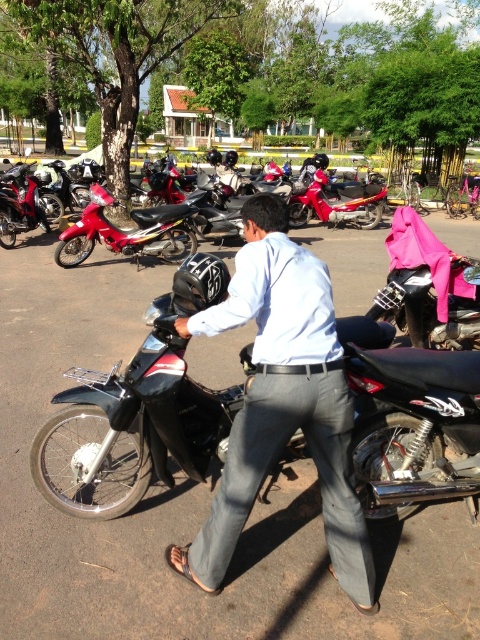
Is shiny black motorcycle at center above light blue shirt at center?

Actually, shiny black motorcycle at center is below light blue shirt at center.

This screenshot has height=640, width=480. What are the coordinates of `shiny black motorcycle at center` in the screenshot? It's located at (140, 413).

The height and width of the screenshot is (640, 480). What are the coordinates of `shiny black motorcycle at center` in the screenshot? It's located at (140, 413).

Who is taller, light blue shirt at center or matte red motorcycle at left?

matte red motorcycle at left

The height and width of the screenshot is (640, 480). I want to click on light blue shirt at center, so click(x=282, y=403).

Who is higher up, light blue shirt at center or shiny red motorcycle at center?

shiny red motorcycle at center is above.

Which is behind, point (216, 316) or point (112, 237)?

The point (112, 237) is more distant.

Does point (365, 557) come closer to viewer compared to point (170, 218)?

Yes, it is in front of point (170, 218).

Image resolution: width=480 pixels, height=640 pixels. Find the location of `light blue shirt at center`. light blue shirt at center is located at coordinates (282, 403).